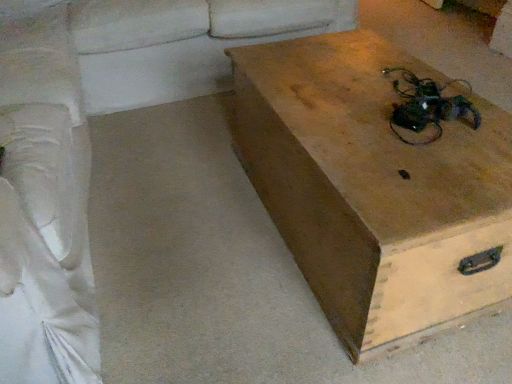
Question: Is white fabric couch at upper left, the second couch positioned from the left, at the back of white fabric couch at left, which ranks as the 1th couch in left-to-right order?

Choices:
 (A) no
 (B) yes

Answer: (A)

Question: Can you confirm if white fabric couch at left, which ranks as the 1th couch in left-to-right order, is bigger than white fabric couch at upper left, which appears as the 1th couch when viewed from the right?

Choices:
 (A) no
 (B) yes

Answer: (B)

Question: Considering the relative sizes of white fabric couch at left, placed as the second couch when sorted from right to left, and white fabric couch at upper left, the second couch positioned from the left, in the image provided, is white fabric couch at left, placed as the second couch when sorted from right to left, taller than white fabric couch at upper left, the second couch positioned from the left,?

Choices:
 (A) yes
 (B) no

Answer: (A)

Question: Is white fabric couch at upper left, which appears as the 1th couch when viewed from the right, located within white fabric couch at left, placed as the second couch when sorted from right to left?

Choices:
 (A) no
 (B) yes

Answer: (A)

Question: From the image's perspective, is white fabric couch at left, placed as the second couch when sorted from right to left, below white fabric couch at upper left, the second couch positioned from the left?

Choices:
 (A) no
 (B) yes

Answer: (B)

Question: Considering the relative sizes of white fabric couch at left, placed as the second couch when sorted from right to left, and white fabric couch at upper left, which appears as the 1th couch when viewed from the right, in the image provided, is white fabric couch at left, placed as the second couch when sorted from right to left, shorter than white fabric couch at upper left, which appears as the 1th couch when viewed from the right,?

Choices:
 (A) no
 (B) yes

Answer: (A)

Question: Is white fabric couch at left, which ranks as the 1th couch in left-to-right order, to the right of wooden box at center from the viewer's perspective?

Choices:
 (A) no
 (B) yes

Answer: (A)

Question: Does white fabric couch at left, which ranks as the 1th couch in left-to-right order, appear on the left side of wooden box at center?

Choices:
 (A) yes
 (B) no

Answer: (A)

Question: Does white fabric couch at left, placed as the second couch when sorted from right to left, have a larger size compared to wooden box at center?

Choices:
 (A) no
 (B) yes

Answer: (B)

Question: From the image's perspective, is white fabric couch at left, which ranks as the 1th couch in left-to-right order, on top of wooden box at center?

Choices:
 (A) no
 (B) yes

Answer: (B)

Question: Does white fabric couch at left, placed as the second couch when sorted from right to left, have a lesser height compared to wooden box at center?

Choices:
 (A) yes
 (B) no

Answer: (B)

Question: Is white fabric couch at left, placed as the second couch when sorted from right to left, located outside wooden box at center?

Choices:
 (A) no
 (B) yes

Answer: (B)

Question: From a real-world perspective, is smooth beige couch at lower left beneath white fabric couch at left, which ranks as the 1th couch in left-to-right order?

Choices:
 (A) no
 (B) yes

Answer: (B)